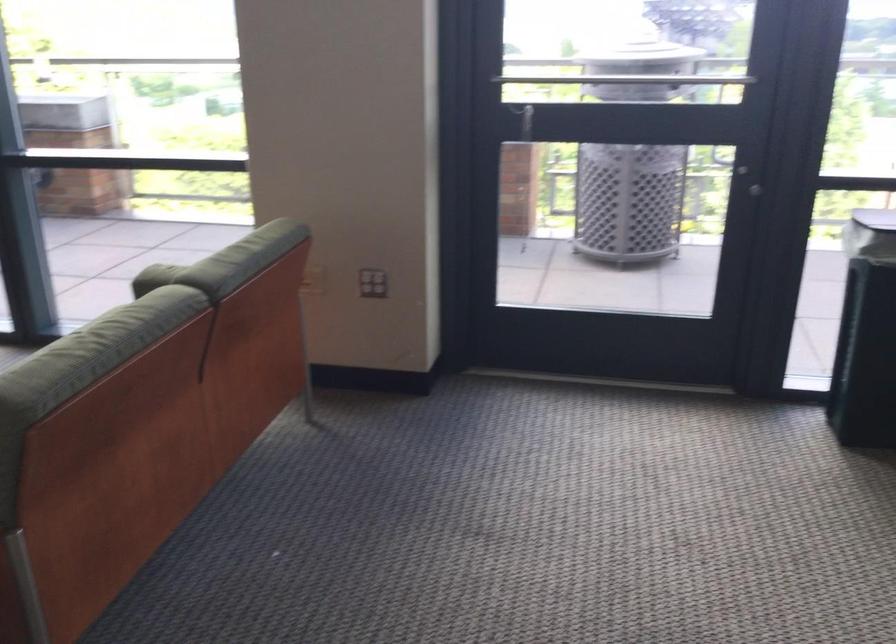
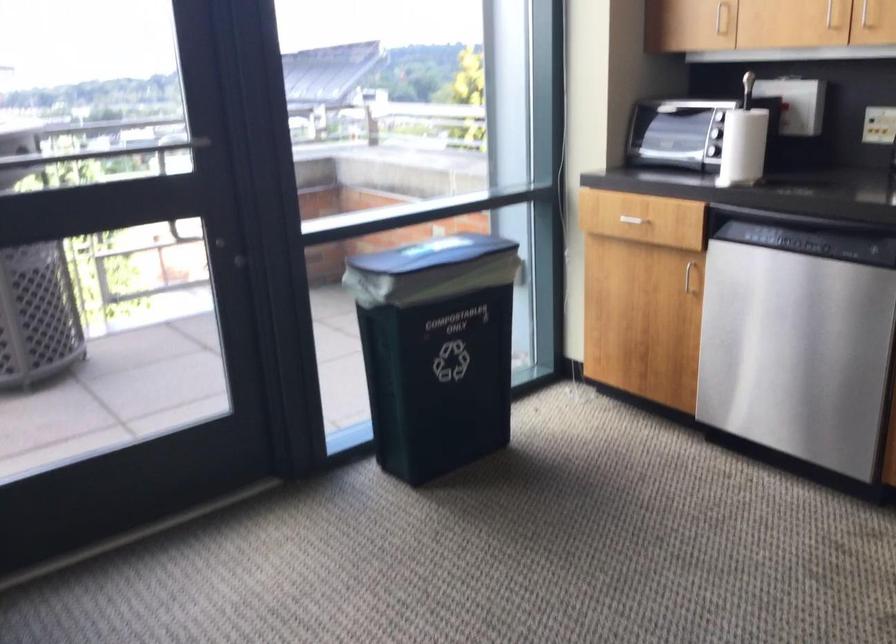
Question: The images are taken continuously from a first-person perspective. In which direction is your viewpoint rotating?

Choices:
 (A) Left
 (B) Right
 (C) Up
 (D) Down

Answer: (B)